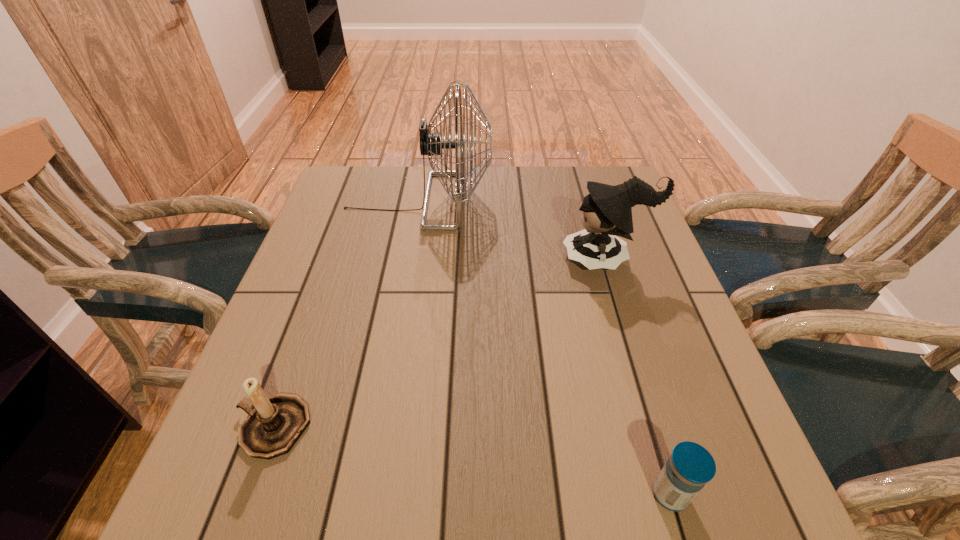
The height and width of the screenshot is (540, 960). Find the location of `fan`. fan is located at coordinates (431, 144).

Image resolution: width=960 pixels, height=540 pixels. What are the coordinates of `the tallest object` in the screenshot? It's located at (431, 144).

Find the location of a particular element. the third shortest object is located at coordinates (607, 211).

Where is `doll`? doll is located at coordinates (607, 211).

Image resolution: width=960 pixels, height=540 pixels. Identify the location of the second nearest object. (276, 423).

You are a GUI agent. You are given a task and a screenshot of the screen. Output one action in this format:
    pyautogui.click(x=<x>, y=<y>)
    Task: Click on the third tallest object
    This screenshot has height=540, width=960.
    Given the screenshot: What is the action you would take?
    pyautogui.click(x=276, y=423)

The height and width of the screenshot is (540, 960). Identify the location of medicine. (690, 466).

Where is `the shortest object`? The image size is (960, 540). the shortest object is located at coordinates (690, 466).

Locate an element on the screen. free space located on the front-facing side of the farthest object is located at coordinates (630, 201).

Find the location of a particular element. This screenshot has width=960, height=540. vacant region located at the face of the third shortest object is located at coordinates (538, 259).